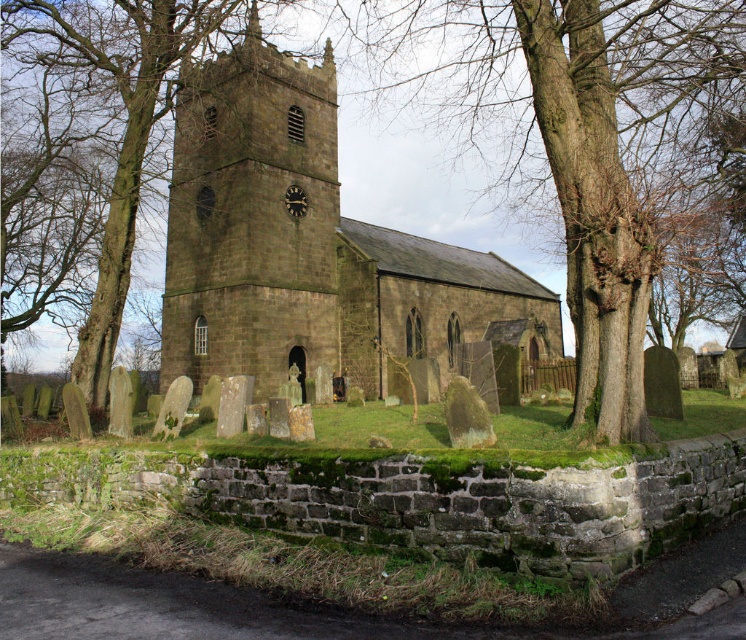
You are a photographer planning to take a wide shot of the dark brown stone church at center. You want to ensure the brown rough tree at center doesn not block the view of the church in your photo. Based on their sizes, is this possible?

The brown rough tree at center is larger in size than the dark brown stone church at center, so it might block the view of the church in your photo depending on the angle and distance. To avoid obstruction, position yourself further back or adjust your angle to frame the church around the tree.

You are standing in front of the dark brown stone church at center and want to take a photo of the brown rough tree at center. Which direction should you face to capture the tree in your shot?

You should face to the right of the dark brown stone church at center to capture the brown rough tree at center in your shot since the brown rough tree at center is located to the right of the dark brown stone church at center according to the description.